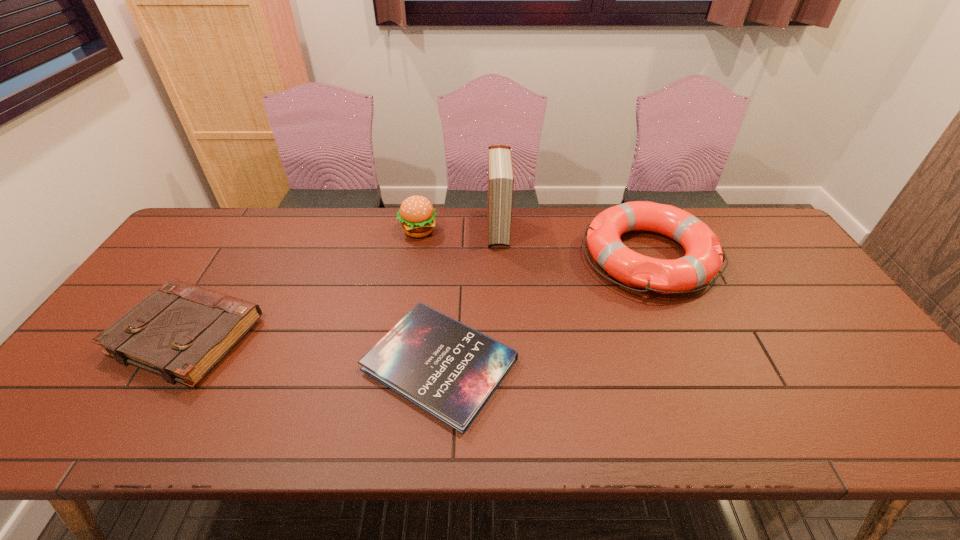
Image resolution: width=960 pixels, height=540 pixels. I want to click on free space that is in between the leftmost object and the hamburger, so click(x=303, y=283).

Where is `free space between the shortest object and the farthest hardback book`? The width and height of the screenshot is (960, 540). free space between the shortest object and the farthest hardback book is located at coordinates (468, 297).

Identify the location of free space between the hamburger and the life buoy. The width and height of the screenshot is (960, 540). click(x=534, y=244).

The height and width of the screenshot is (540, 960). I want to click on the fourth closest object to the life buoy, so click(x=181, y=331).

Choose which object is the nearest neighbor to the hamburger. Please provide its 2D coordinates. Your answer should be formatted as a tuple, i.e. [(x, y)], where the tuple contains the x and y coordinates of a point satisfying the conditions above.

[(500, 168)]

The width and height of the screenshot is (960, 540). What are the coordinates of `hardback book that is the nearest to the leftmost object` in the screenshot? It's located at (x=450, y=370).

Select which hardback book appears as the second closest to the hamburger. Please provide its 2D coordinates. Your answer should be formatted as a tuple, i.e. [(x, y)], where the tuple contains the x and y coordinates of a point satisfying the conditions above.

[(450, 370)]

Identify the location of free space that satisfies the following two spatial constraints: 1. on the open cover of the tallest object; 2. on the right side of the third shortest object. The width and height of the screenshot is (960, 540). (499, 257).

Identify the location of vacant space that satisfies the following two spatial constraints: 1. on the open cover of the tallest hardback book; 2. on the left side of the third shortest object. The image size is (960, 540). point(499,257).